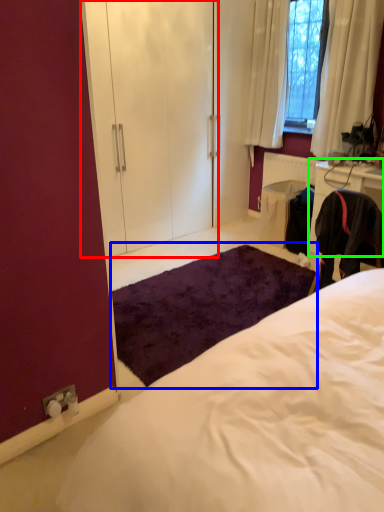
Question: Based on their relative distances, which object is nearer to armoire (highlighted by a red box)? Choose from mat (highlighted by a blue box) and cabinetry (highlighted by a green box).

Choices:
 (A) mat
 (B) cabinetry

Answer: (A)